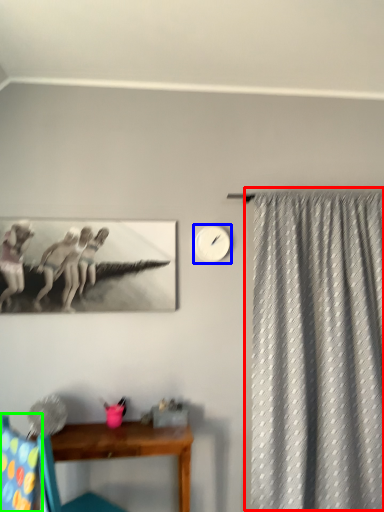
Question: Based on their relative distances, which object is farther from curtain (highlighted by a red box)? Choose from clock (highlighted by a blue box) and swivel chair (highlighted by a green box).

Choices:
 (A) clock
 (B) swivel chair

Answer: (B)